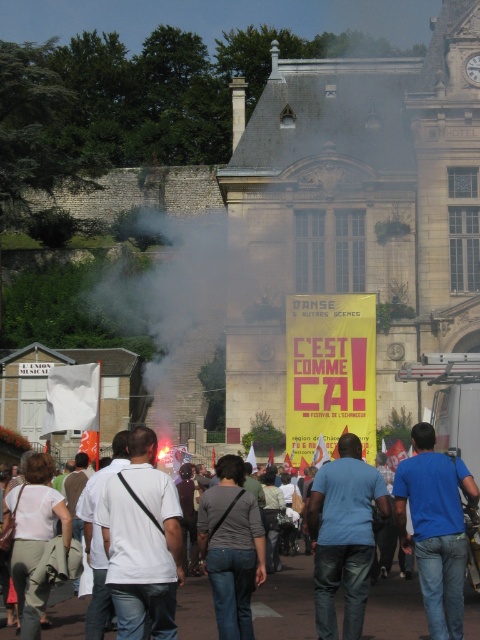
Question: Is white smoke at center wider than blue denim jeans at lower right?

Choices:
 (A) yes
 (B) no

Answer: (A)

Question: Is the position of white smoke at center more distant than that of denim jeans at center?

Choices:
 (A) no
 (B) yes

Answer: (B)

Question: Among these objects, which one is farthest from the camera?

Choices:
 (A) light beige fabric purse at lower left
 (B) white smoke at center
 (C) blue denim jeans at lower right
 (D) blue denim jeans at center

Answer: (B)

Question: Can you confirm if white smoke at center is positioned above denim jeans at center?

Choices:
 (A) yes
 (B) no

Answer: (A)

Question: Which object is the farthest from the denim jeans at center?

Choices:
 (A) white cotton shirt at center
 (B) blue denim jeans at center
 (C) blue denim jeans at lower right
 (D) light beige fabric purse at lower left

Answer: (C)

Question: Considering the real-world distances, which object is farthest from the white cotton shirt at center?

Choices:
 (A) blue denim jeans at lower right
 (B) denim jeans at center

Answer: (A)